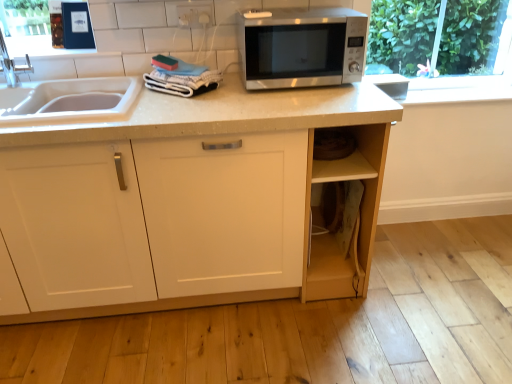
Question: Relative to matte white cabinet at center, is satin silver microwave at center in front or behind?

Choices:
 (A) front
 (B) behind

Answer: (B)

Question: From a real-world perspective, relative to matte white cabinet at center, is satin silver microwave at center vertically above or below?

Choices:
 (A) above
 (B) below

Answer: (A)

Question: Estimate the real-world distances between objects in this image. Which object is farther from the white plastic electric outlet at upper center?

Choices:
 (A) satin silver microwave at center
 (B) blue matte book at upper left
 (C) matte white cabinet at center

Answer: (C)

Question: Considering the real-world distances, which object is farthest from the white plastic electric outlet at upper center?

Choices:
 (A) matte white cabinet at center
 (B) blue matte book at upper left
 (C) satin silver microwave at center

Answer: (A)